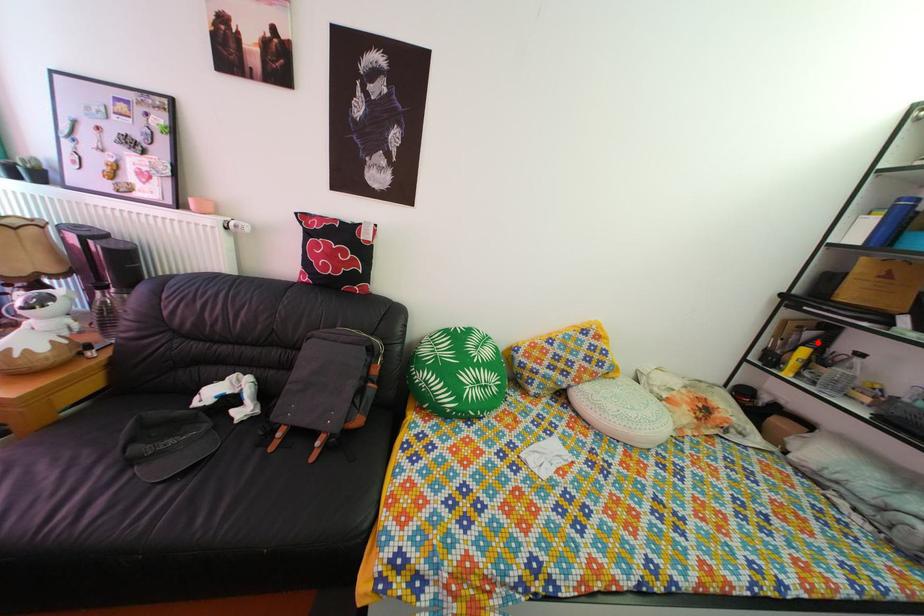
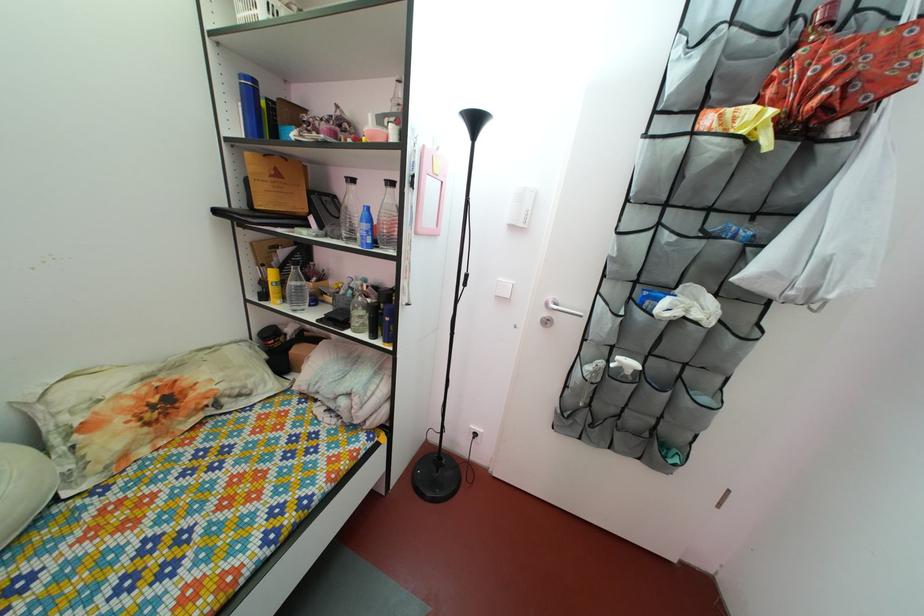
Find the pixel in the second image that matches the highlighted location in the first image.

(292, 262)